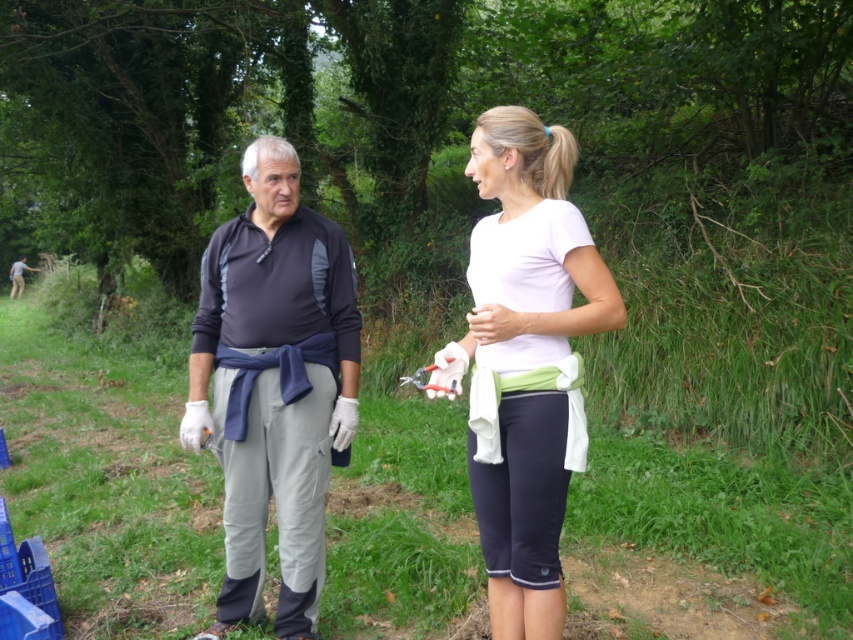
Between point (476, 170) and point (13, 282), which one is positioned in front?

Positioned in front is point (476, 170).

Is matte black shirt at center thinner than camouflage fabric shirt at left?

Correct, matte black shirt at center's width is less than camouflage fabric shirt at left's.

Is point (563, 300) closer to viewer compared to point (9, 296)?

Yes.

Identify the location of matte black shirt at center. (525, 358).

Can you confirm if dark gray fleece at center is positioned to the left of matte black shirt at center?

Correct, you'll find dark gray fleece at center to the left of matte black shirt at center.

Does point (292, 150) come in front of point (471, 332)?

That is False.

Image resolution: width=853 pixels, height=640 pixels. What do you see at coordinates (274, 385) in the screenshot? I see `dark gray fleece at center` at bounding box center [274, 385].

Locate an element on the screen. This screenshot has height=640, width=853. dark gray fleece at center is located at coordinates (274, 385).

Is matte black shirt at center further to the viewer compared to white matte t-shirt at center?

Yes, matte black shirt at center is behind white matte t-shirt at center.

Which is behind, point (189, 394) or point (482, 301)?

Positioned behind is point (189, 394).

The height and width of the screenshot is (640, 853). I want to click on matte black shirt at center, so click(x=525, y=358).